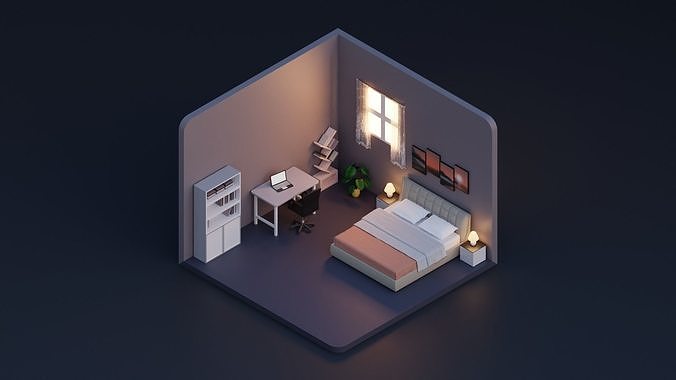
You are a GUI agent. You are given a task and a screenshot of the screen. Output one action in this format:
    pyautogui.click(x=<x>, y=<y>)
    Task: Click on the window
    Image resolution: width=676 pixels, height=380 pixels.
    Given the screenshot: What is the action you would take?
    pyautogui.click(x=380, y=120)